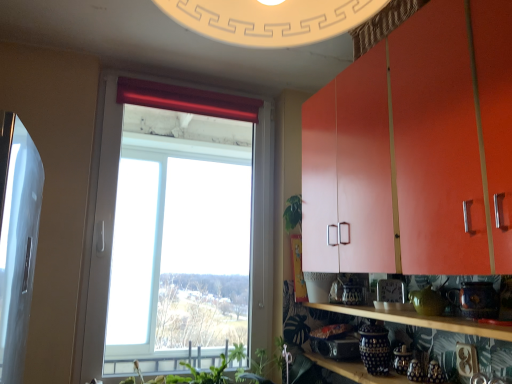
Identify the location of free space above red velvet curtain at upper center (from a real-world perspective). (194, 90).